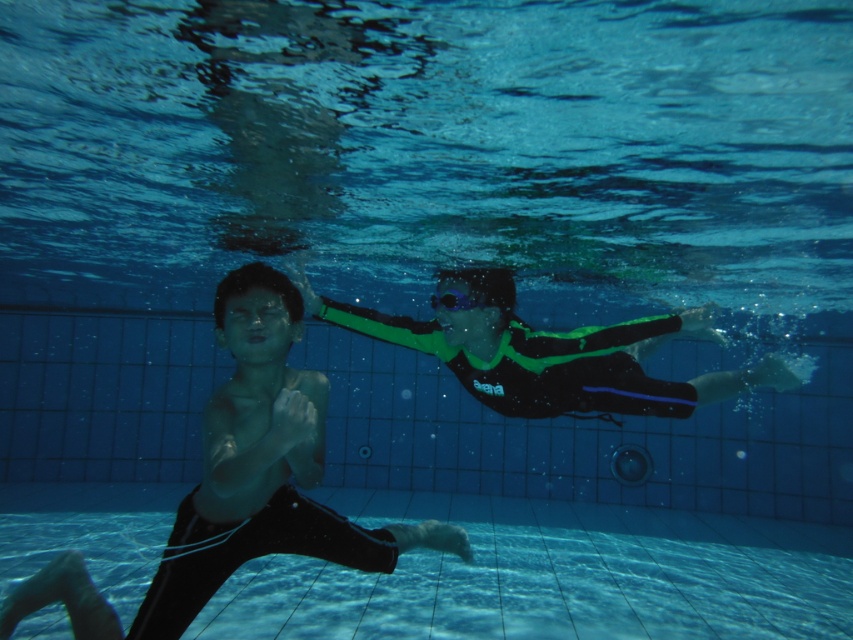
Question: Is transparent plastic swimmer at lower center closer to the viewer compared to transparent plastic goggles at center?

Choices:
 (A) no
 (B) yes

Answer: (A)

Question: Which object is closer to the camera taking this photo?

Choices:
 (A) black matte wetsuit at center
 (B) green matte wetsuit at center

Answer: (A)

Question: Can you confirm if transparent plastic swimmer at lower center is positioned to the right of black matte wetsuit at center?

Choices:
 (A) no
 (B) yes

Answer: (B)

Question: Among these points, which one is nearest to the camera?

Choices:
 (A) (454, 292)
 (B) (419, 340)
 (C) (798, 547)

Answer: (A)

Question: Is black matte wetsuit at center to the right of transparent plastic goggles at center from the viewer's perspective?

Choices:
 (A) no
 (B) yes

Answer: (A)

Question: Which object is farther from the camera taking this photo?

Choices:
 (A) transparent plastic goggles at center
 (B) green matte wetsuit at center
 (C) transparent plastic swimmer at lower center
 (D) black matte wetsuit at center

Answer: (C)